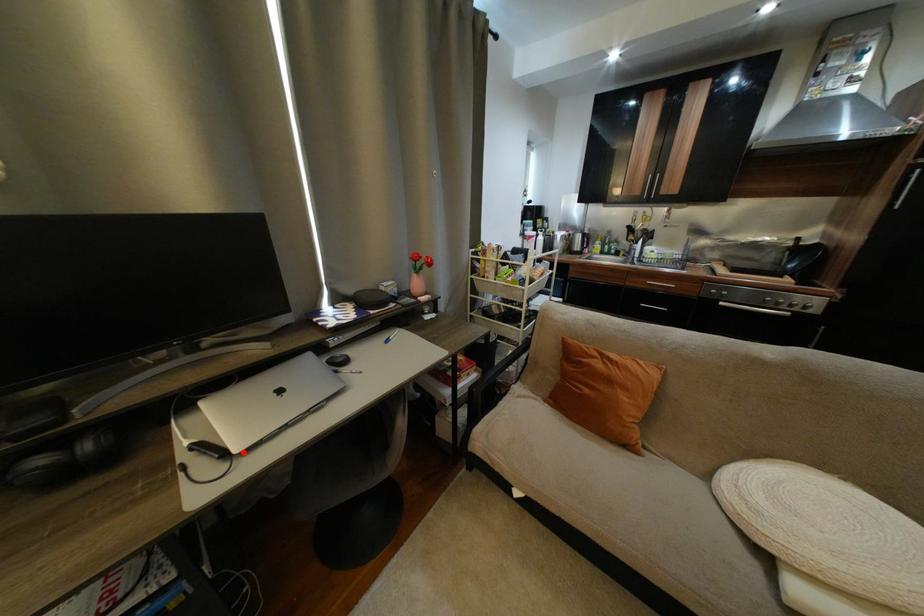
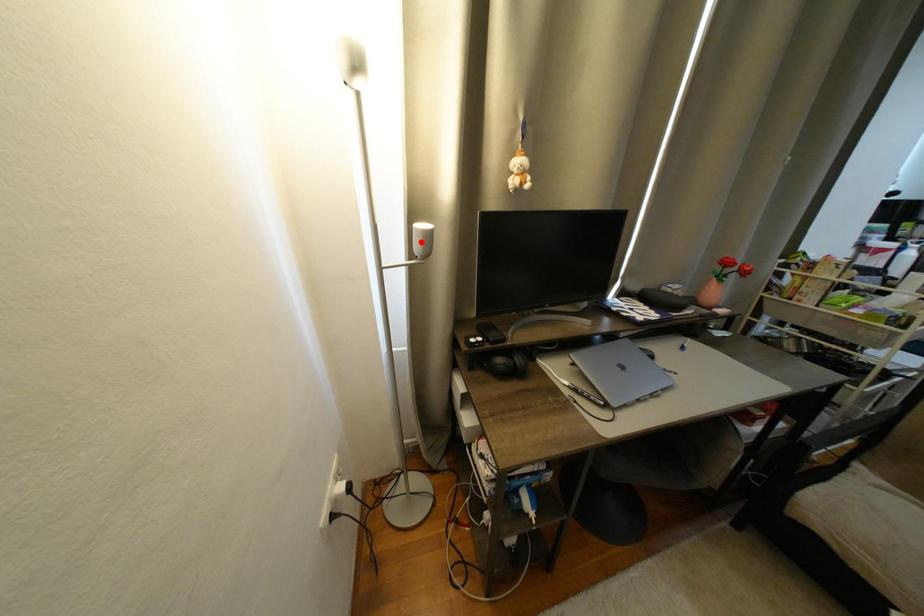
I am providing you with two images of the same scene from different viewpoints. A red point is marked on the first image and another point is marked on the second image. Do the highlighted points in image1 and image2 indicate the same real-world spot?

No